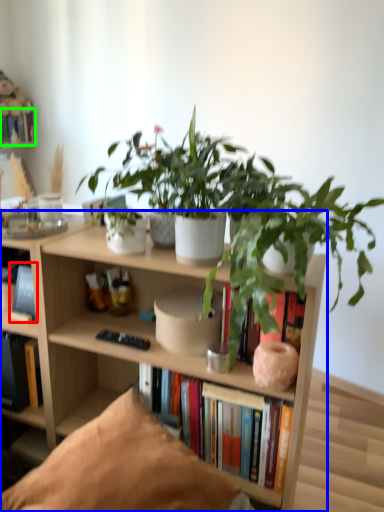
Question: Which object is positioned farthest from book (highlighted by a red box)? Select from bookcase (highlighted by a blue box) and book (highlighted by a green box).

Choices:
 (A) bookcase
 (B) book

Answer: (B)